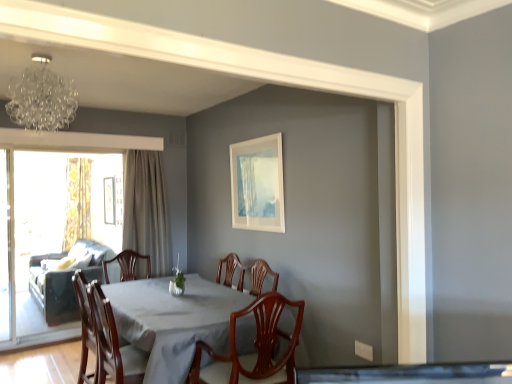
What do you see at coordinates (147, 210) in the screenshot?
I see `silky gray curtain at left, the second curtain when ordered from left to right` at bounding box center [147, 210].

In order to face silky gray curtain at left, which appears as the second curtain when viewed from the back, should I rotate leftwards or rightwards?

To align with it, rotate left about 15.587°.

The height and width of the screenshot is (384, 512). What do you see at coordinates (77, 201) in the screenshot? I see `gold textured curtain at left, arranged as the 1th curtain when viewed from the left` at bounding box center [77, 201].

Measure the distance between point (2, 216) and camera.

Point (2, 216) is 13.25 feet away from camera.

This screenshot has height=384, width=512. I want to click on clear glass screen door at left, which ranks as the first screen door in left-to-right order, so click(7, 247).

This screenshot has height=384, width=512. What do you see at coordinates (255, 347) in the screenshot? I see `mahogany wood chair at center, placed as the first chair when sorted from front to back` at bounding box center [255, 347].

In order to face wooden chair at center, which is counted as the second chair, starting from the front, should I rotate leftwards or rightwards?

To align with it, rotate left about 18.618°.

Locate an element on the screen. The image size is (512, 384). dark gray fabric couch at left is located at coordinates (53, 291).

Which object is positioned more to the left, wooden chair at center, positioned as the 2th chair in right-to-left order, or transparent glass screen door at left, marked as the 1th screen door in a right-to-left arrangement?

transparent glass screen door at left, marked as the 1th screen door in a right-to-left arrangement.

Which of these two, wooden chair at center, which is counted as the second chair, starting from the front, or transparent glass screen door at left, marked as the 2th screen door in a left-to-right arrangement, stands taller?

Standing taller between the two is transparent glass screen door at left, marked as the 2th screen door in a left-to-right arrangement.

Can we say wooden chair at center, positioned as the 2th chair in right-to-left order, lies outside transparent glass screen door at left, marked as the 1th screen door in a right-to-left arrangement?

Absolutely, wooden chair at center, positioned as the 2th chair in right-to-left order, is external to transparent glass screen door at left, marked as the 1th screen door in a right-to-left arrangement.

From a real-world perspective, relative to transparent glass screen door at left, marked as the 2th screen door in a left-to-right arrangement, is wooden chair at center, which is counted as the second chair, starting from the front, vertically above or below?

wooden chair at center, which is counted as the second chair, starting from the front, is situated lower than transparent glass screen door at left, marked as the 2th screen door in a left-to-right arrangement, in the real world.

Could you measure the distance between white glossy table at center and silky gray curtain at left, which appears as the second curtain when viewed from the back?

white glossy table at center is 4.36 feet from silky gray curtain at left, which appears as the second curtain when viewed from the back.

Consider the image. Between white glossy table at center and silky gray curtain at left, which appears as the second curtain when viewed from the back, which one has larger size?

Bigger between the two is white glossy table at center.

Considering their positions, is white glossy table at center located in front of or behind silky gray curtain at left, arranged as the first curtain when viewed from the right?

Visually, white glossy table at center is located in front of silky gray curtain at left, arranged as the first curtain when viewed from the right.

Which object is wider, white glossy table at center or silky gray curtain at left, arranged as the first curtain when viewed from the right?

Wider between the two is white glossy table at center.

Is silky gray curtain at left, the second curtain when ordered from left to right, surrounding white matte picture frame at upper center, the second picture frame viewed from the back?

No, white matte picture frame at upper center, the second picture frame viewed from the back, is not inside silky gray curtain at left, the second curtain when ordered from left to right.

Is silky gray curtain at left, the second curtain when ordered from left to right, taller than white matte picture frame at upper center, the second picture frame viewed from the back?

Yes.

Are silky gray curtain at left, the second curtain when ordered from left to right, and white matte picture frame at upper center, the 1th picture frame in the right-to-left sequence, beside each other?

silky gray curtain at left, the second curtain when ordered from left to right, and white matte picture frame at upper center, the 1th picture frame in the right-to-left sequence, are not in contact.

Is silky gray curtain at left, the second curtain when ordered from left to right, in front of or behind white matte picture frame at upper center, the second picture frame viewed from the back, in the image?

silky gray curtain at left, the second curtain when ordered from left to right, is behind white matte picture frame at upper center, the second picture frame viewed from the back.

Is white matte picture frame at upper center, arranged as the 2th picture frame when viewed from the left, positioned far away from transparent glass screen door at left, marked as the 1th screen door in a right-to-left arrangement?

white matte picture frame at upper center, arranged as the 2th picture frame when viewed from the left, is far away from transparent glass screen door at left, marked as the 1th screen door in a right-to-left arrangement.

Does point (267, 145) lie in front of point (66, 172)?

Yes, it is in front of point (66, 172).

Is white matte picture frame at upper center, which is the first picture frame in front-to-back order, bigger than transparent glass screen door at left, marked as the 2th screen door in a left-to-right arrangement?

Actually, white matte picture frame at upper center, which is the first picture frame in front-to-back order, might be smaller than transparent glass screen door at left, marked as the 2th screen door in a left-to-right arrangement.

Based on the photo, considering the relative sizes of dark gray fabric couch at left and white matte picture frame at upper center, which is the first picture frame in front-to-back order, in the image provided, is dark gray fabric couch at left shorter than white matte picture frame at upper center, which is the first picture frame in front-to-back order,?

No.

From the image's perspective, would you say dark gray fabric couch at left is shown under white matte picture frame at upper center, arranged as the 2th picture frame when viewed from the left?

Correct, dark gray fabric couch at left appears lower than white matte picture frame at upper center, arranged as the 2th picture frame when viewed from the left, in the image.

The width and height of the screenshot is (512, 384). Identify the location of the 2nd picture frame directly above the dark gray fabric couch at left (from a real-world perspective). (258, 184).

Which of these two, dark gray fabric couch at left or white matte picture frame at upper center, which is the first picture frame in front-to-back order, is thinner?

With smaller width is white matte picture frame at upper center, which is the first picture frame in front-to-back order.

Based on the photo, is mahogany wood chair at center, which is the 1th chair from right to left, facing away from wooden chair at center, which is counted as the second chair, starting from the front?

No, wooden chair at center, which is counted as the second chair, starting from the front, is not at the back of mahogany wood chair at center, which is the 1th chair from right to left.

Considering their positions, is mahogany wood chair at center, positioned as the second chair in back-to-front order, located in front of or behind wooden chair at center, which ranks as the first chair in left-to-right order?

Visually, mahogany wood chair at center, positioned as the second chair in back-to-front order, is located in front of wooden chair at center, which ranks as the first chair in left-to-right order.

Is mahogany wood chair at center, placed as the first chair when sorted from front to back, smaller than wooden chair at center, which is counted as the second chair, starting from the front?

Correct, mahogany wood chair at center, placed as the first chair when sorted from front to back, occupies less space than wooden chair at center, which is counted as the second chair, starting from the front.

Does point (209, 349) appear closer or farther from the camera than point (95, 320)?

Clearly, point (209, 349) is closer to the camera than point (95, 320).

Which point is more forward, (x=113, y=254) or (x=120, y=227)?

The point (x=113, y=254) is in front.

Is dark gray fabric couch at left positioned far away from transparent glass screen door at left, marked as the 2th screen door in a left-to-right arrangement?

No.

Does dark gray fabric couch at left have a lesser height compared to transparent glass screen door at left, marked as the 1th screen door in a right-to-left arrangement?

Correct, dark gray fabric couch at left is not as tall as transparent glass screen door at left, marked as the 1th screen door in a right-to-left arrangement.

Which object is wider, dark gray fabric couch at left or transparent glass screen door at left, marked as the 2th screen door in a left-to-right arrangement?

With larger width is dark gray fabric couch at left.

From a real-world perspective, which chair is the 2nd one underneath the transparent glass screen door at left, marked as the 1th screen door in a right-to-left arrangement? Please provide its 2D coordinates.

[(104, 338)]

From a real-world perspective, count 1st curtains upward from the white glossy table at center and point to it. Please provide its 2D coordinates.

[(147, 210)]

Based on their spatial positions, is gold textured curtain at left, the 1th curtain in the back-to-front sequence, or crystal glass chandelier at upper left further from white glossy table at center?

gold textured curtain at left, the 1th curtain in the back-to-front sequence.

Based on their spatial positions, is white glossy table at center or transparent glass screen door at left, marked as the 1th screen door in a right-to-left arrangement, further from mahogany wood chair at center, which appears as the second chair when viewed from the left?

Based on the image, transparent glass screen door at left, marked as the 1th screen door in a right-to-left arrangement, appears to be further to mahogany wood chair at center, which appears as the second chair when viewed from the left.

When comparing their distances from silky gray curtain at left, the 1th curtain positioned from the front, does crystal glass chandelier at upper left or wooden chair at center, positioned as the 2th chair in right-to-left order, seem further?

Based on the image, crystal glass chandelier at upper left appears to be further to silky gray curtain at left, the 1th curtain positioned from the front.

Consider the image. Considering their positions, is wooden chair at center, which ranks as the 1th chair in back-to-front order, positioned further to gold textured curtain at left, the 1th curtain in the back-to-front sequence, than crystal glass chandelier at upper left?

Among the two, crystal glass chandelier at upper left is located further to gold textured curtain at left, the 1th curtain in the back-to-front sequence.

From the image, which object appears to be nearer to clear glass screen door at left, which ranks as the first screen door in left-to-right order, mahogany wood chair at center, placed as the first chair when sorted from front to back, or transparent glass screen door at left, marked as the 2th screen door in a left-to-right arrangement?

transparent glass screen door at left, marked as the 2th screen door in a left-to-right arrangement.

Based on their spatial positions, is wooden chair at center, which ranks as the first chair in left-to-right order, or white matte picture frame at upper center, arranged as the 2th picture frame when viewed from the left, closer to clear glass screen door at left, the 2th screen door viewed from the right?

wooden chair at center, which ranks as the first chair in left-to-right order, lies closer to clear glass screen door at left, the 2th screen door viewed from the right, than the other object.

Estimate the real-world distances between objects in this image. Which object is closer to mahogany wood chair at center, positioned as the second chair in back-to-front order, dark gray fabric couch at left or clear glass screen door at left, which ranks as the first screen door in left-to-right order?

The object closer to mahogany wood chair at center, positioned as the second chair in back-to-front order, is dark gray fabric couch at left.

From the image, which object appears to be farther from wooden chair at center, which is counted as the second chair, starting from the front, gold textured curtain at left, the second curtain positioned from the right, or clear glass screen door at left, which ranks as the first screen door in left-to-right order?

The object further to wooden chair at center, which is counted as the second chair, starting from the front, is gold textured curtain at left, the second curtain positioned from the right.

This screenshot has height=384, width=512. Identify the location of lamp between white glossy table at center and silky gray curtain at left, the second curtain when ordered from left to right, along the z-axis. (41, 98).

You are a GUI agent. You are given a task and a screenshot of the screen. Output one action in this format:
    pyautogui.click(x=<x>, y=<y>)
    Task: Click on the studio couch positioned between clear glass screen door at left, the 2th screen door viewed from the right, and gold textured curtain at left, the second curtain positioned from the right, from near to far
    
    Given the screenshot: What is the action you would take?
    pyautogui.click(x=53, y=291)

Where is `curtain between mahogany wood chair at center, placed as the first chair when sorted from front to back, and white matte picture frame at upper center, positioned as the first picture frame in back-to-front order, along the z-axis`? curtain between mahogany wood chair at center, placed as the first chair when sorted from front to back, and white matte picture frame at upper center, positioned as the first picture frame in back-to-front order, along the z-axis is located at coordinates (147, 210).

Locate an element on the screen. kitchen & dining room table located between mahogany wood chair at center, positioned as the second chair in back-to-front order, and white matte picture frame at upper center, arranged as the 2th picture frame when viewed from the left, in the depth direction is located at coordinates (173, 321).